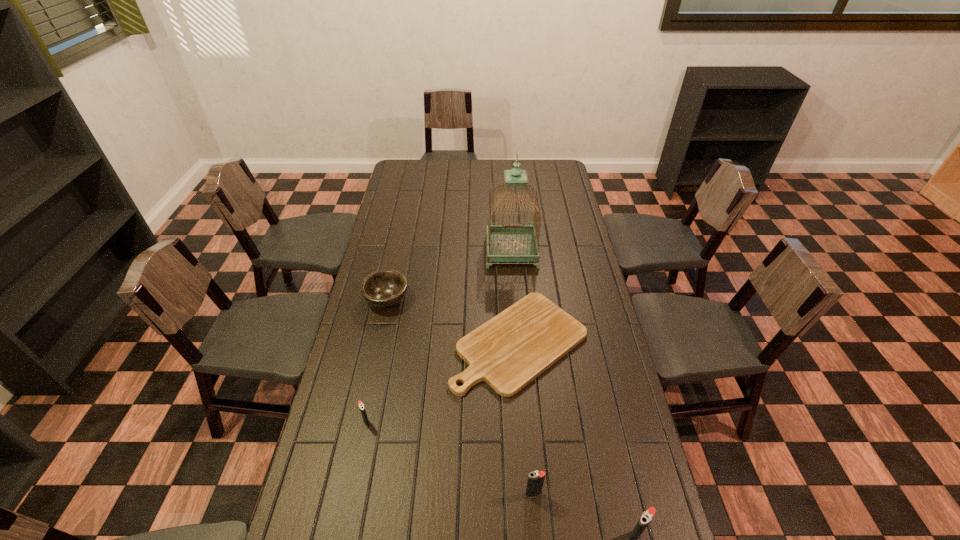
The width and height of the screenshot is (960, 540). In order to click on the farthest igniter in this screenshot , I will do `click(361, 405)`.

Where is `the leftmost igniter`? the leftmost igniter is located at coordinates (361, 405).

The image size is (960, 540). Identify the location of the fifth farthest object. (535, 481).

The width and height of the screenshot is (960, 540). I want to click on the fourth shortest object, so click(535, 481).

This screenshot has width=960, height=540. I want to click on chopping board, so click(510, 350).

Where is `bowl`? bowl is located at coordinates (385, 288).

Identify the location of birdcage. (509, 242).

Find the location of a particular element. the farthest object is located at coordinates (509, 242).

Find the location of `vacant space situated 0.270m on the back of the farthest igniter`. vacant space situated 0.270m on the back of the farthest igniter is located at coordinates (382, 345).

The height and width of the screenshot is (540, 960). What are the coordinates of `free spot located on the left of the second shortest igniter` in the screenshot? It's located at (425, 494).